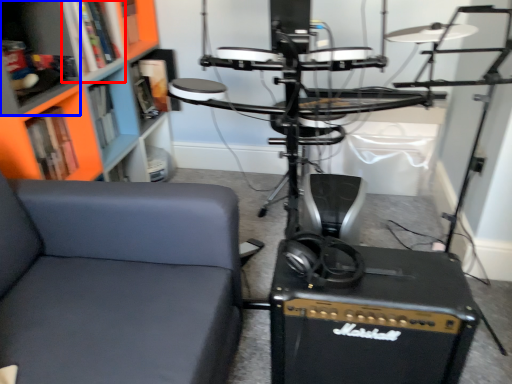
Question: Which object is further to the camera taking this photo, shelf (highlighted by a red box) or shelf (highlighted by a blue box)?

Choices:
 (A) shelf
 (B) shelf

Answer: (A)